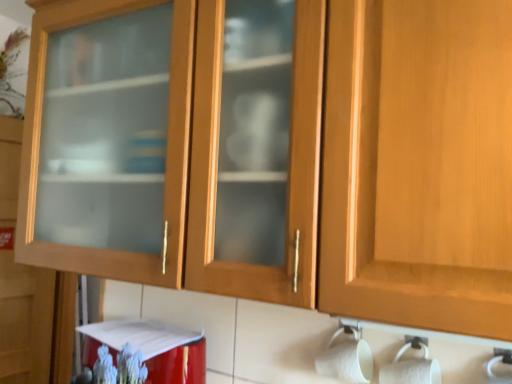
Question: From a real-world perspective, is red glossy appliance at lower left above or below white matte toilet paper at lower right?

Choices:
 (A) below
 (B) above

Answer: (A)

Question: Considering the positions of red glossy appliance at lower left and white matte toilet paper at lower right in the image, is red glossy appliance at lower left taller or shorter than white matte toilet paper at lower right?

Choices:
 (A) short
 (B) tall

Answer: (B)

Question: Which is nearer to the red glossy appliance at lower left?

Choices:
 (A) matte glass cabinet at left
 (B) white matte toilet paper at lower right

Answer: (B)

Question: Estimate the real-world distances between objects in this image. Which object is closer to the matte glass cabinet at left?

Choices:
 (A) white matte toilet paper at lower right
 (B) red glossy appliance at lower left

Answer: (B)